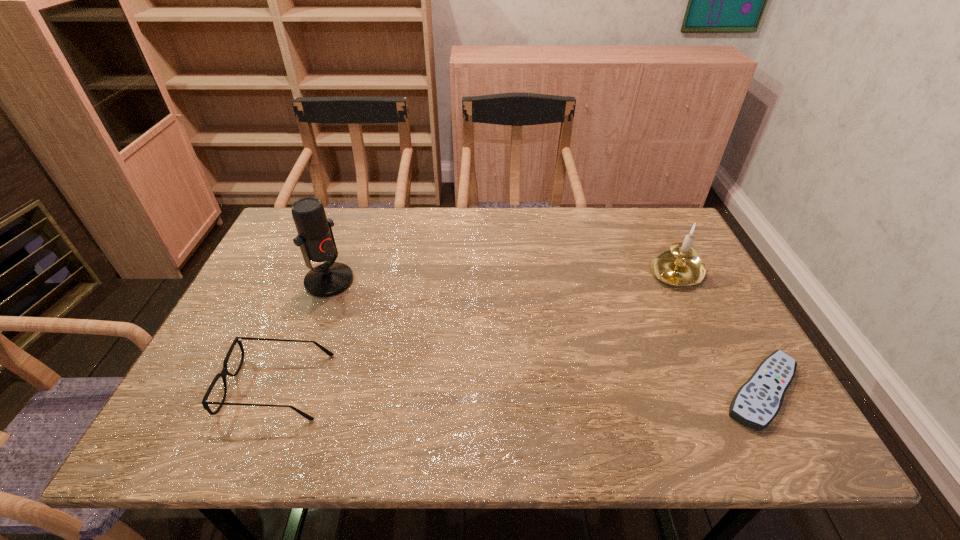
This screenshot has height=540, width=960. Find the location of `vacant space that's between the tallest object and the spectacles`. vacant space that's between the tallest object and the spectacles is located at coordinates (303, 334).

The width and height of the screenshot is (960, 540). I want to click on free space between the microphone and the third shortest object, so click(x=502, y=276).

Identify the location of vacant area that lies between the candle holder and the spectacles. (476, 329).

I want to click on free space between the microphone and the third shortest object, so click(502, 276).

Where is `vacant space in between the shortest object and the second tallest object`? vacant space in between the shortest object and the second tallest object is located at coordinates (718, 332).

Point out which object is positioned as the nearest to the tallest object. Please provide its 2D coordinates. Your answer should be formatted as a tuple, i.e. [(x, y)], where the tuple contains the x and y coordinates of a point satisfying the conditions above.

[(224, 372)]

Identify the location of object identified as the third closest to the shortest object. (315, 237).